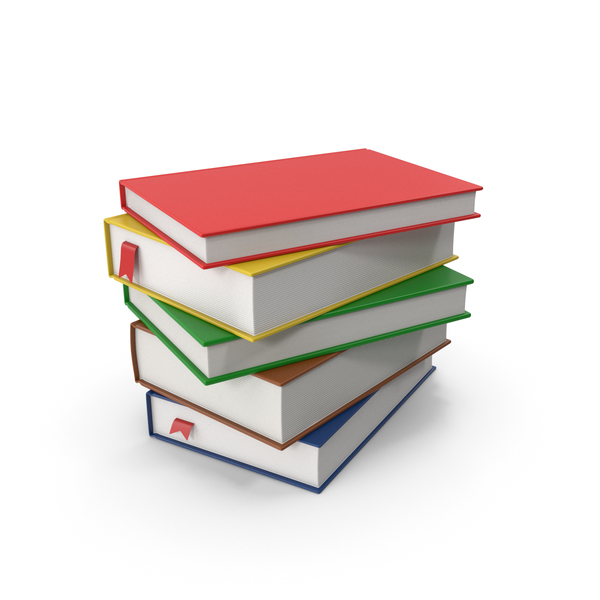
Where is `book pages`? This screenshot has height=600, width=600. book pages is located at coordinates (251, 452), (255, 414), (258, 348), (326, 275), (335, 225).